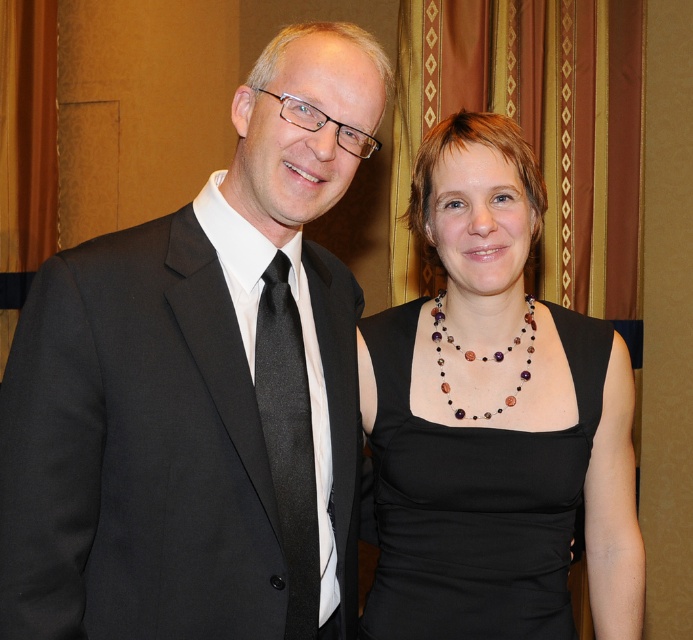
You are a photographer setting up for a portrait shoot. You need to ensure that the black satin suit at center and the black silk tie at left are clearly visible in the frame. Given that your camera has a minimum focus distance of 4 inches, will both items be in focus?

The black satin suit at center is 4.36 inches from the black silk tie at left. Since the minimum focus distance is 4 inches, both items are within the required distance and should be in focus.

You are standing in front of the two people in the image. Which of the two points, point 1 at coordinates point (x=493, y=497) or point 2 at coordinates point (x=315, y=608), is farther away from you?

Point 1 at coordinates point (x=493, y=497) is farther away from you because it is positioned behind point 2 at coordinates point (x=315, y=608).